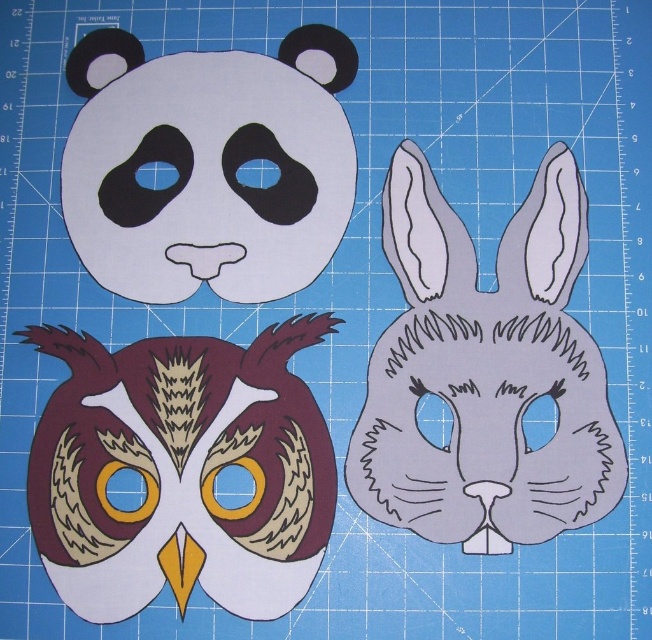
Question: Which point is farther to the camera?

Choices:
 (A) (138, 536)
 (B) (565, 269)
 (C) (158, 192)

Answer: (C)

Question: Is matte brown owl at center positioned in front of matte brown owl mask at center?

Choices:
 (A) no
 (B) yes

Answer: (A)

Question: Is matte brown owl at center positioned at the back of matte brown paper owl at upper left?

Choices:
 (A) no
 (B) yes

Answer: (A)

Question: Is matte brown owl at center further to the viewer compared to matte brown owl mask at center?

Choices:
 (A) no
 (B) yes

Answer: (B)

Question: Which object appears closest to the camera in this image?

Choices:
 (A) matte brown owl at center
 (B) matte brown owl mask at center
 (C) matte brown paper owl at upper left

Answer: (B)

Question: Which of the following is the farthest from the observer?

Choices:
 (A) (497, 385)
 (B) (140, 120)

Answer: (B)